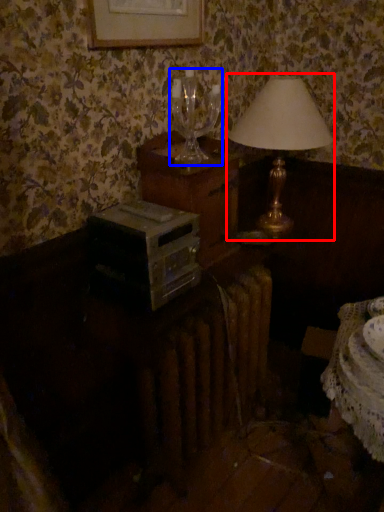
Question: Among these objects, which one is nearest to the camera, lamp (highlighted by a red box) or wine glass (highlighted by a blue box)?

Choices:
 (A) lamp
 (B) wine glass

Answer: (B)